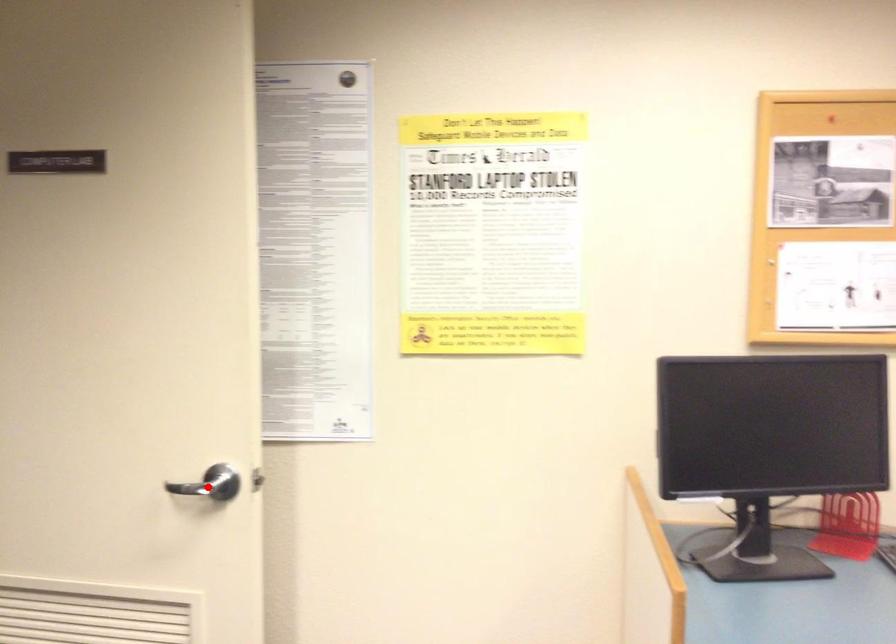
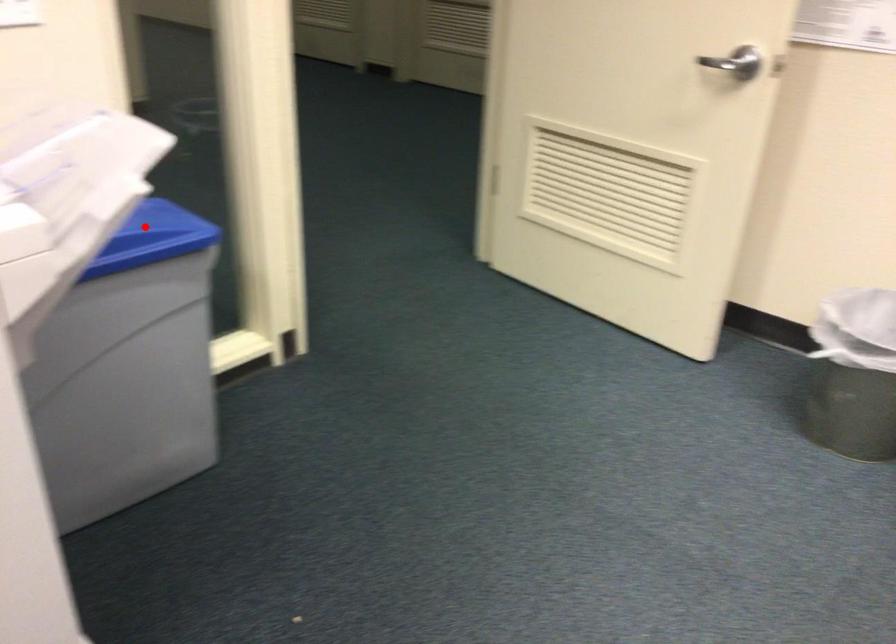
I am providing you with two images of the same scene from different viewpoints. A red point is marked on the first image and another point is marked on the second image. Do the highlighted points in image1 and image2 indicate the same real-world spot?

No